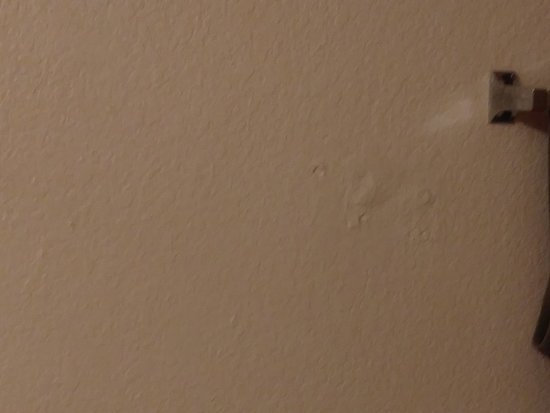
The image size is (550, 413). I want to click on front of towel rack mount, so click(x=538, y=102).